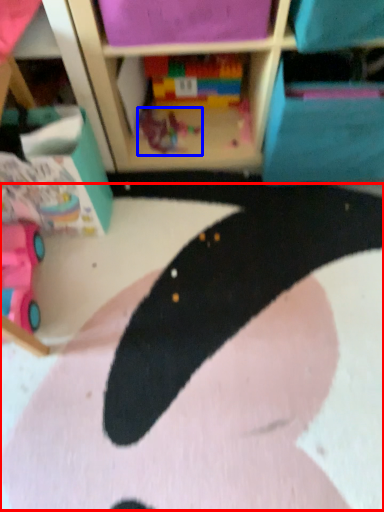
Question: Among these objects, which one is nearest to the camera, animal (highlighted by a red box) or toy (highlighted by a blue box)?

Choices:
 (A) animal
 (B) toy

Answer: (A)